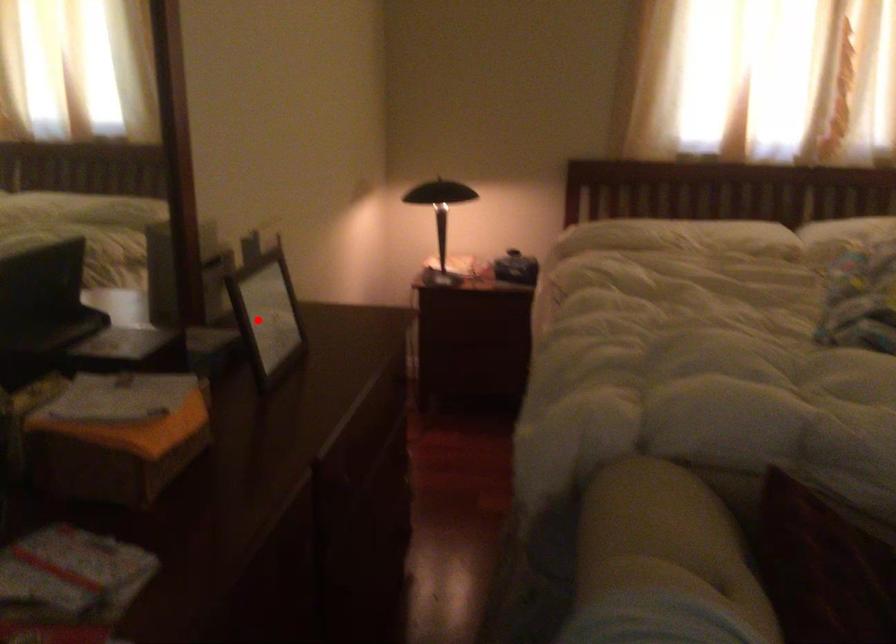
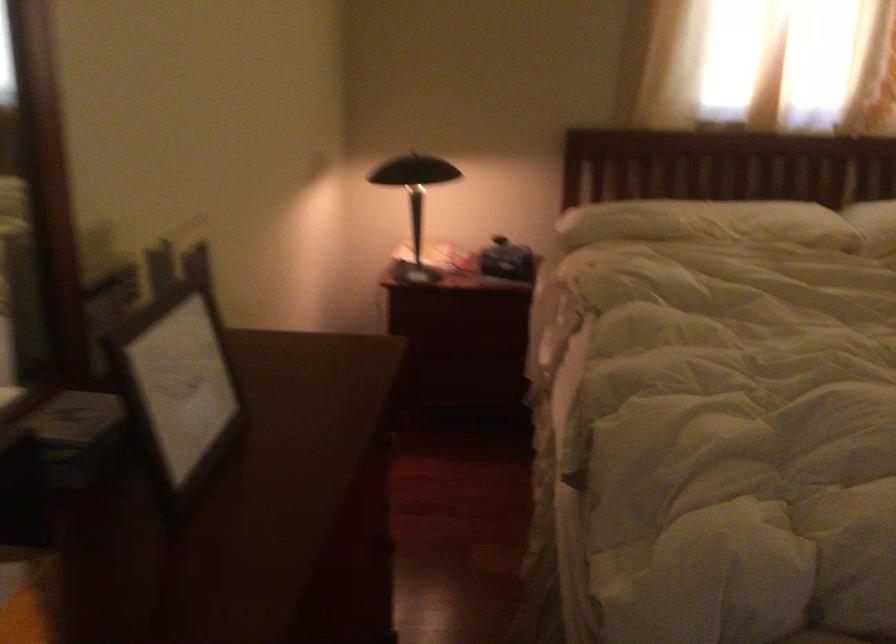
Locate, in the second image, the point that corresponds to the highlighted location in the first image.

(177, 386)